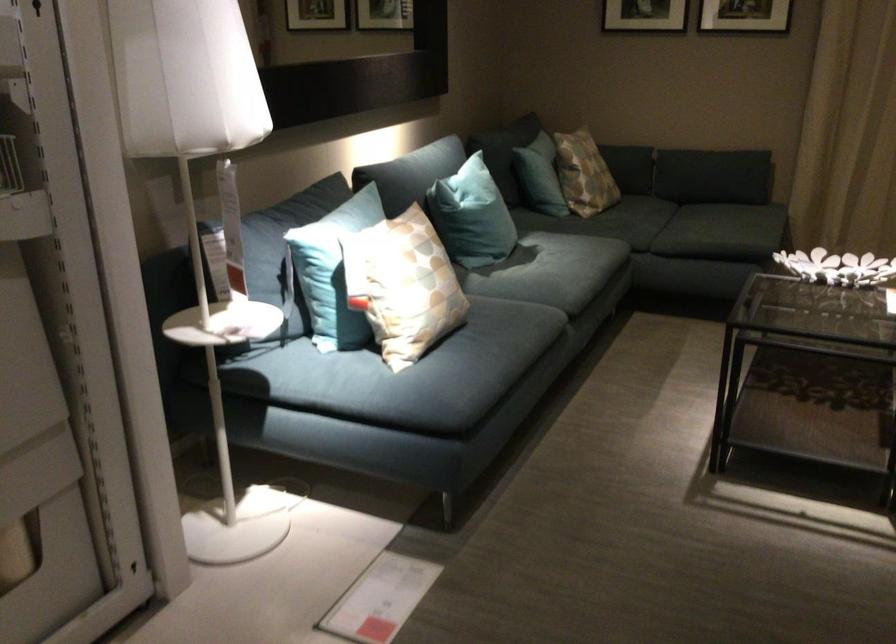
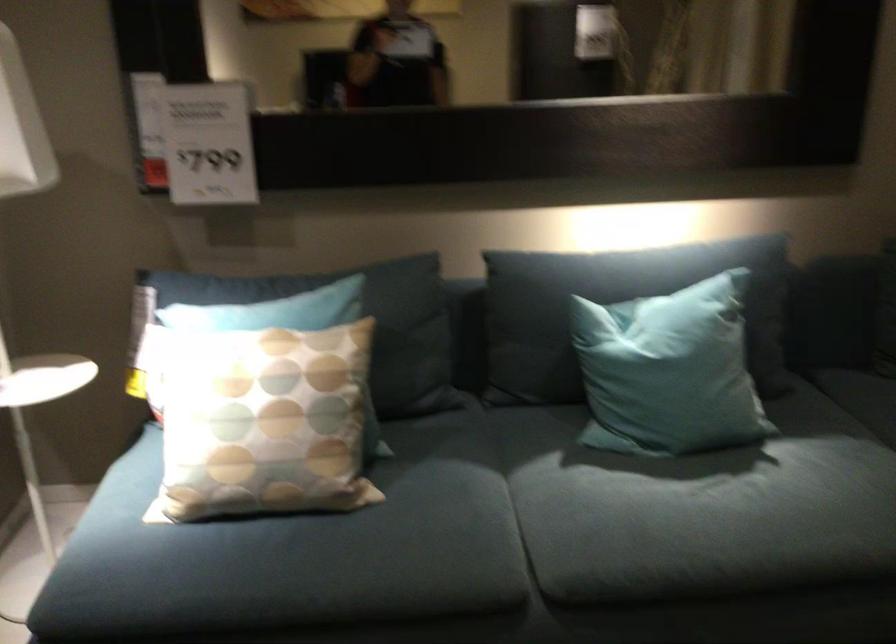
Locate, in the second image, the point that corresponds to (504,313) in the first image.

(406, 526)